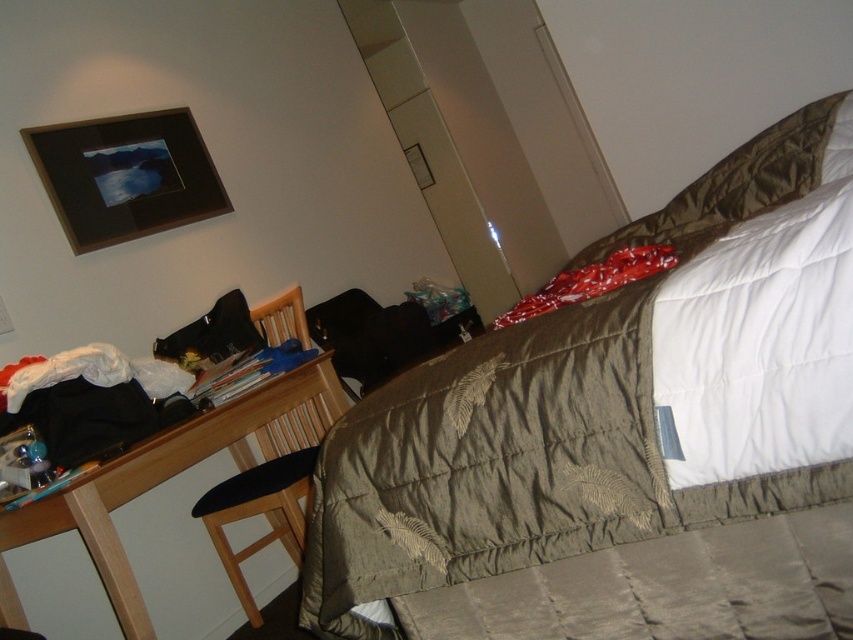
Question: Is textured olive green comforter at center behind wooden chair at center?

Choices:
 (A) no
 (B) yes

Answer: (A)

Question: Which of these objects is positioned farthest from the textured olive green comforter at center?

Choices:
 (A) wooden desk at lower left
 (B) black wood picture frame at upper left

Answer: (B)

Question: Does textured olive green comforter at center come behind black wood picture frame at upper left?

Choices:
 (A) no
 (B) yes

Answer: (A)

Question: Which object is the closest to the textured olive green comforter at center?

Choices:
 (A) wooden chair at center
 (B) wooden desk at lower left
 (C) black wood picture frame at upper left

Answer: (B)

Question: Estimate the real-world distances between objects in this image. Which object is farther from the wooden desk at lower left?

Choices:
 (A) textured olive green comforter at center
 (B) wooden chair at center

Answer: (A)

Question: From the image, what is the correct spatial relationship of textured olive green comforter at center in relation to wooden chair at center?

Choices:
 (A) below
 (B) above

Answer: (B)